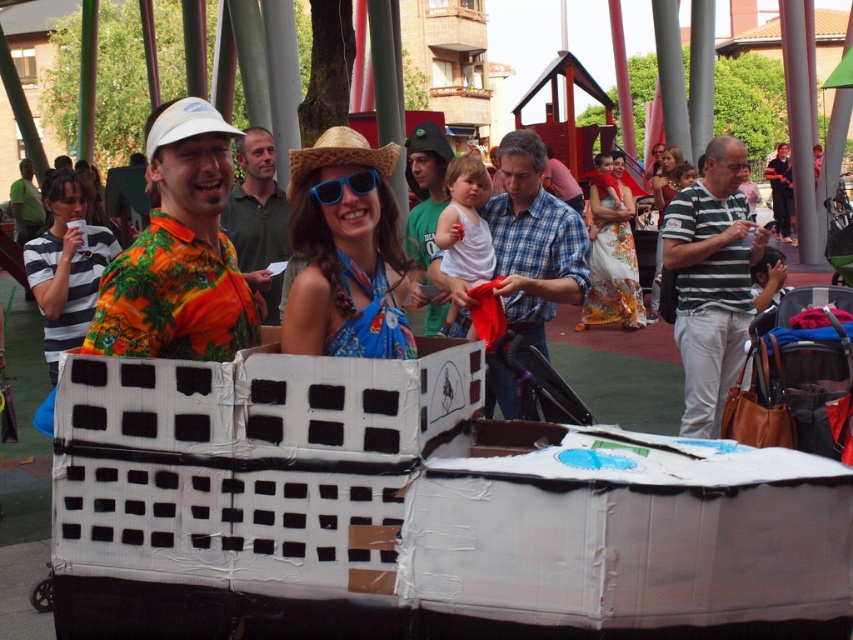
Can you confirm if hawaiian print shirt at center is bigger than green cotton shirt at center?

Correct, hawaiian print shirt at center is larger in size than green cotton shirt at center.

Which is more to the left, hawaiian print shirt at center or green cotton shirt at center?

From the viewer's perspective, hawaiian print shirt at center appears more on the left side.

Find the location of a particular element. This screenshot has height=640, width=853. hawaiian print shirt at center is located at coordinates (180, 252).

At what (x,y) coordinates should I click in order to perform the action: click on hawaiian print shirt at center. Please return your answer as a coordinate pair (x, y). Looking at the image, I should click on (180, 252).

Between point (164, 346) and point (384, 145), which one is positioned in front?

Point (164, 346) is in front.

Is hawaiian print shirt at center closer to the viewer compared to blue fabric dress at center?

Yes, it is in front of blue fabric dress at center.

Where is `hawaiian print shirt at center`? This screenshot has height=640, width=853. hawaiian print shirt at center is located at coordinates (180, 252).

Who is more distant from viewer, (x=682, y=332) or (x=256, y=173)?

Point (x=256, y=173)

Can you confirm if striped cotton shirt at center is thinner than orange floral shirt at center?

In fact, striped cotton shirt at center might be wider than orange floral shirt at center.

Does point (741, 152) come farther from viewer compared to point (242, 236)?

No, it is in front of (242, 236).

This screenshot has height=640, width=853. Identify the location of striped cotton shirt at center. (711, 282).